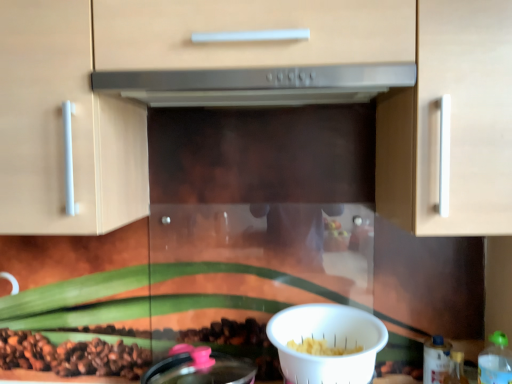
Question: Is point (324, 359) positioned closer to the camera than point (454, 350)?

Choices:
 (A) closer
 (B) farther

Answer: (A)

Question: From a real-world perspective, relative to translucent plastic bottle at lower right, placed as the second bottle when sorted from front to back, is white plastic bowl at lower center vertically above or below?

Choices:
 (A) below
 (B) above

Answer: (B)

Question: Estimate the real-world distances between objects in this image. Which object is closer to the translucent plastic bottle at lower right, which is the third bottle from front to back?

Choices:
 (A) satin silver range hood at center
 (B) green plastic bottle at lower right, which is the third bottle in back-to-front order
 (C) translucent plastic bottle at lower right, which is counted as the second bottle, starting from the back
 (D) matte wood cabinet at center
 (E) white plastic bowl at lower center

Answer: (C)

Question: Which is nearer to the satin silver range hood at center?

Choices:
 (A) translucent plastic bottle at lower right, which is the third bottle from front to back
 (B) green plastic bottle at lower right, which is counted as the 1th bottle, starting from the front
 (C) matte wood cabinet at center
 (D) translucent plastic bottle at lower right, placed as the second bottle when sorted from front to back
 (E) white plastic bowl at lower center

Answer: (C)